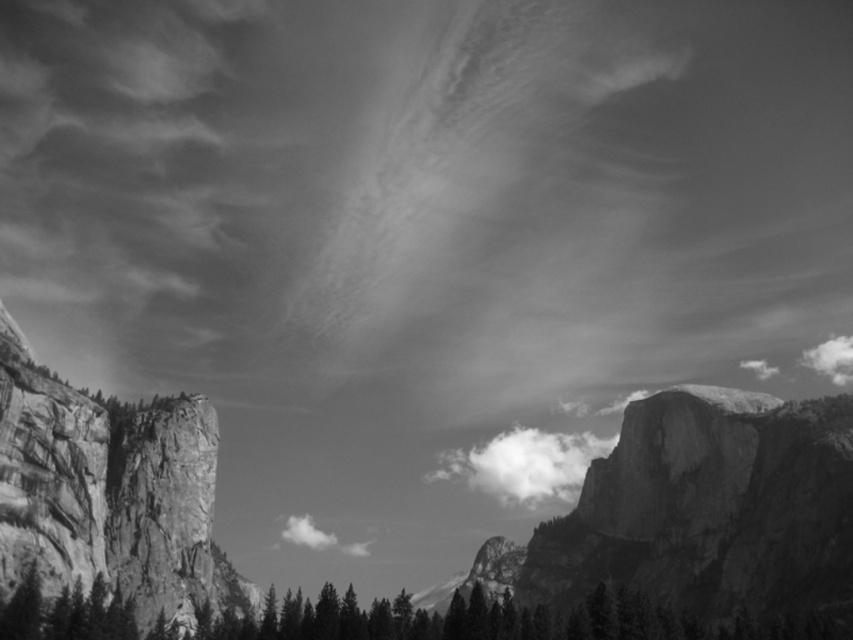
You are a photographer standing in the landscape scene and want to take a photo that includes both the smooth dark green trees at lower center and the white fluffy cloud at center. From your current position, which object would appear to your left when framing the shot?

The smooth dark green trees at lower center would appear to your left when framing the shot because they are positioned on the left side of the white fluffy cloud at center.

You are an artist analyzing this black and white photo. You notice two clouds labeled as white fluffy cloud at center and white cotton cloud at center. Which of these two clouds appears taller in the image?

The white fluffy cloud at center is taller than the white cotton cloud at center.

You are standing in the landscape scene and want to take a photo of the smooth dark green trees at lower center and the white fluffy cloud at center. Which object will appear larger in your photo?

The smooth dark green trees at lower center will appear larger in the photo because they are closer to the viewer than the white fluffy cloud at center.